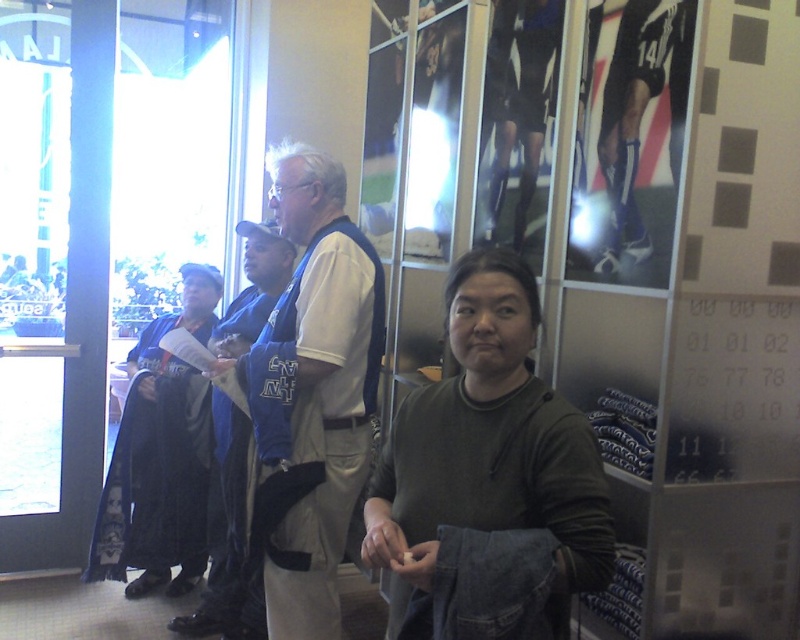
Which is behind, point (580, 552) or point (229, 433)?

Point (229, 433)

Is dark green sweater at center smaller than blue jersey at left?

Yes.

Who is more forward, (458, 500) or (165, 333)?

Point (458, 500)

Find the location of a particular element. The height and width of the screenshot is (640, 800). dark green sweater at center is located at coordinates (490, 448).

Does light beige fabric shirt at center have a larger size compared to blue jersey at left?

Incorrect, light beige fabric shirt at center is not larger than blue jersey at left.

Can you confirm if light beige fabric shirt at center is positioned to the right of blue jersey at left?

Indeed, light beige fabric shirt at center is positioned on the right side of blue jersey at left.

Locate an element on the screen. light beige fabric shirt at center is located at coordinates (310, 397).

At what (x,y) coordinates should I click in order to perform the action: click on light beige fabric shirt at center. Please return your answer as a coordinate pair (x, y). The image size is (800, 640). Looking at the image, I should click on click(310, 397).

Does dark green sweater at center have a greater width compared to light beige fabric shirt at center?

In fact, dark green sweater at center might be narrower than light beige fabric shirt at center.

Does dark green sweater at center lie behind light beige fabric shirt at center?

Result: No, dark green sweater at center is in front of light beige fabric shirt at center.

Is point (462, 468) positioned after point (256, 420)?

No, it is not.

Where is `dark green sweater at center`? dark green sweater at center is located at coordinates (490, 448).